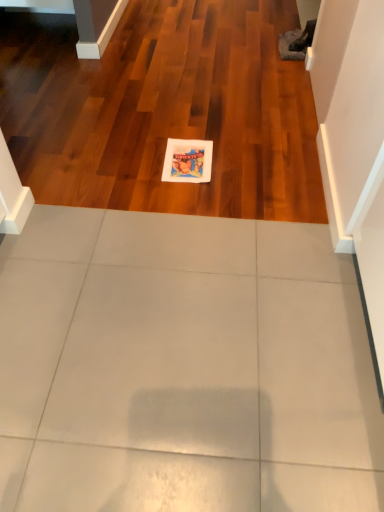
Find the location of `free space to the left of matte paper postcard at center`. free space to the left of matte paper postcard at center is located at coordinates (138, 159).